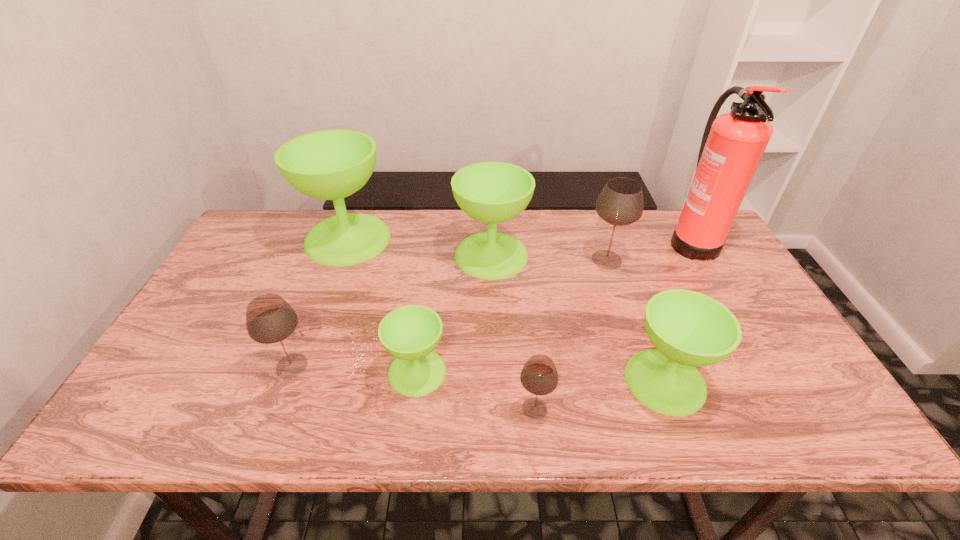
This screenshot has width=960, height=540. I want to click on red fire extinguisher, so click(733, 144).

Locate an element on the screen. the tallest object is located at coordinates (733, 144).

The width and height of the screenshot is (960, 540). In order to click on the biggest green wineglass in this screenshot , I will do `click(330, 164)`.

What are the coordinates of `the leftmost green wineglass` in the screenshot? It's located at (330, 164).

You are a GUI agent. You are given a task and a screenshot of the screen. Output one action in this format:
    pyautogui.click(x=<x>, y=<y>)
    Task: Click on the second green wineglass from right to left
    This screenshot has width=960, height=540.
    Given the screenshot: What is the action you would take?
    pyautogui.click(x=491, y=192)

Where is `the farthest gray wineglass`? This screenshot has width=960, height=540. the farthest gray wineglass is located at coordinates (620, 203).

The width and height of the screenshot is (960, 540). What are the coordinates of `the biggest gray wineglass` in the screenshot? It's located at (620, 203).

This screenshot has height=540, width=960. I want to click on the second farthest gray wineglass, so [270, 319].

At what (x,y) coordinates should I click in order to perform the action: click on the second biggest gray wineglass. Please return your answer as a coordinate pair (x, y). The height and width of the screenshot is (540, 960). Looking at the image, I should click on (270, 319).

I want to click on the third biggest green wineglass, so click(x=688, y=329).